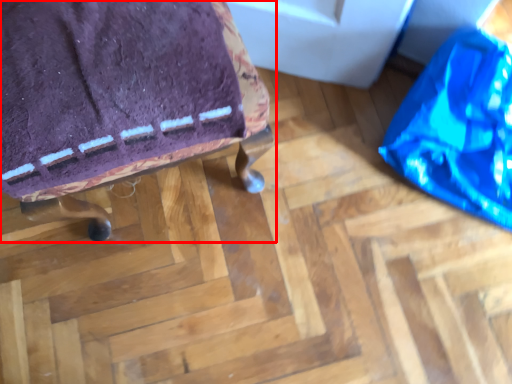
Question: From the image's perspective, where is furniture (annotated by the red box) located in relation to bean bag chair in the image?

Choices:
 (A) below
 (B) above

Answer: (A)